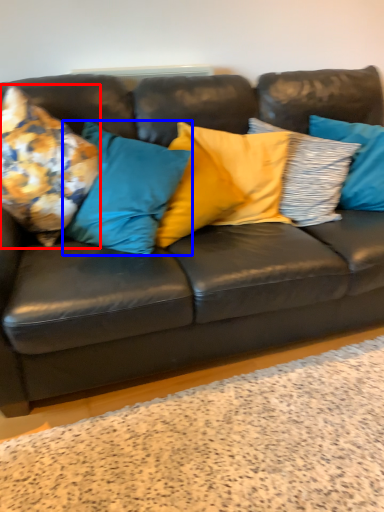
Question: Among these objects, which one is nearest to the camera, pillow (highlighted by a red box) or pillow (highlighted by a blue box)?

Choices:
 (A) pillow
 (B) pillow

Answer: (A)